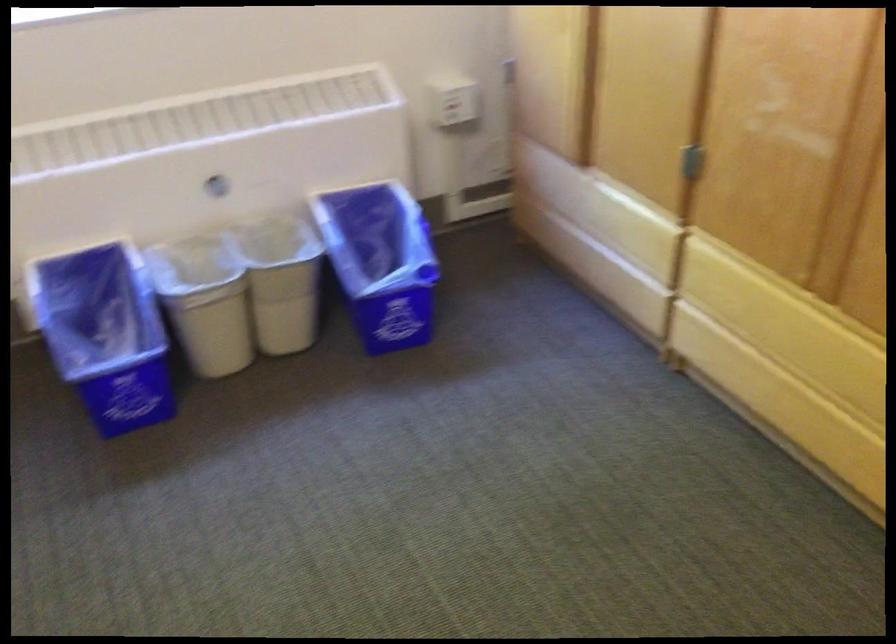
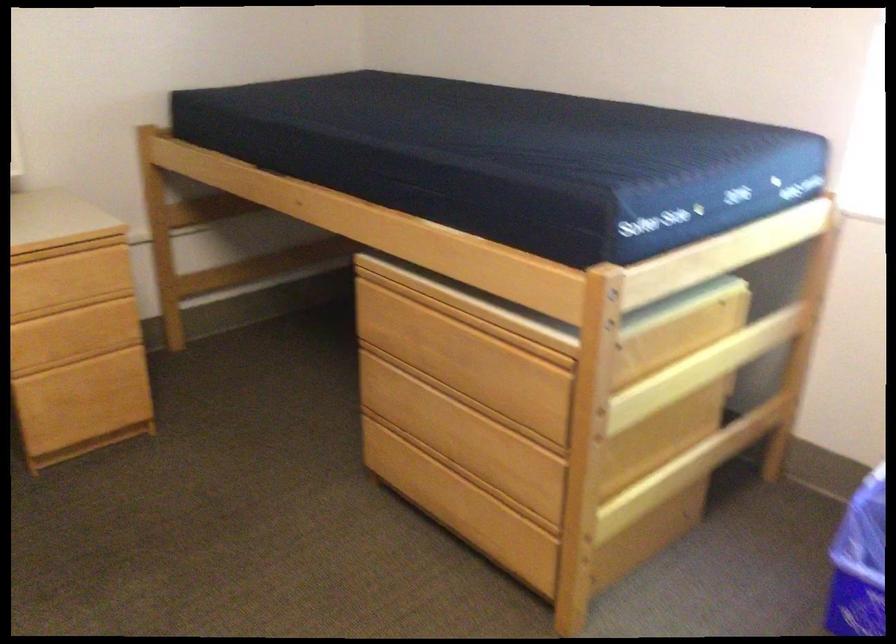
The point at (75, 364) is marked in the first image. Where is the corresponding point in the second image?

(858, 563)